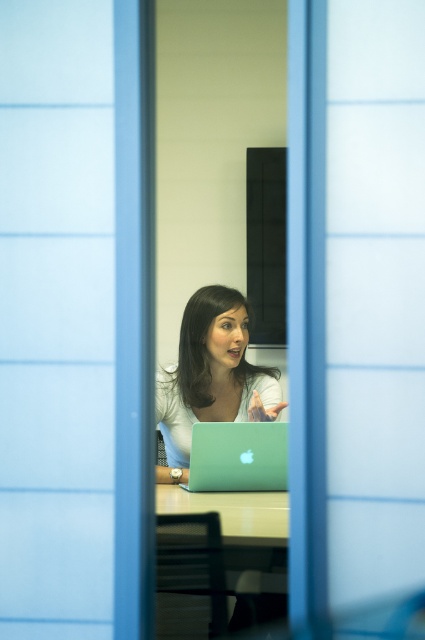
Question: Which object is the closest to the green glossy table at center?

Choices:
 (A) light brown wooden table at center
 (B) matte green laptop at center
 (C) green matte laptop at center

Answer: (A)

Question: Which point appears closest to the camera in this image?

Choices:
 (A) pos(164,508)
 (B) pos(254,483)
 (C) pos(195,528)

Answer: (C)

Question: Which object appears closest to the camera in this image?

Choices:
 (A) green glossy table at center
 (B) green matte laptop at center
 (C) light brown wooden table at center
 (D) matte green laptop at center

Answer: (C)

Question: Does green glossy table at center have a smaller size compared to matte green laptop at center?

Choices:
 (A) yes
 (B) no

Answer: (A)

Question: Is green matte laptop at center in front of light brown wooden table at center?

Choices:
 (A) yes
 (B) no

Answer: (B)

Question: Does matte green laptop at center appear over light brown wooden table at center?

Choices:
 (A) no
 (B) yes

Answer: (B)